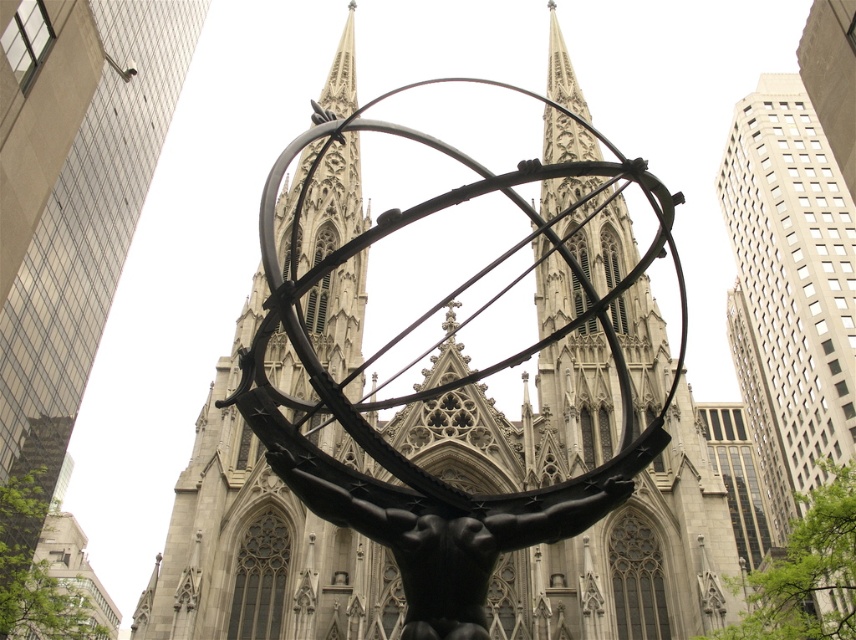
Question: Considering the relative positions of polished bronze atlas at center and black polished statue at center in the image provided, where is polished bronze atlas at center located with respect to black polished statue at center?

Choices:
 (A) above
 (B) below

Answer: (A)

Question: Among these points, which one is farthest from the camera?

Choices:
 (A) (437, 624)
 (B) (331, 531)

Answer: (B)

Question: Is polished bronze atlas at center thinner than black polished statue at center?

Choices:
 (A) yes
 (B) no

Answer: (B)

Question: Which point is closer to the camera taking this photo?

Choices:
 (A) (271, 445)
 (B) (634, 381)

Answer: (A)

Question: Is polished bronze atlas at center below black polished statue at center?

Choices:
 (A) no
 (B) yes

Answer: (A)

Question: Which of the following is the farthest from the observer?

Choices:
 (A) polished bronze atlas at center
 (B) black polished statue at center

Answer: (A)